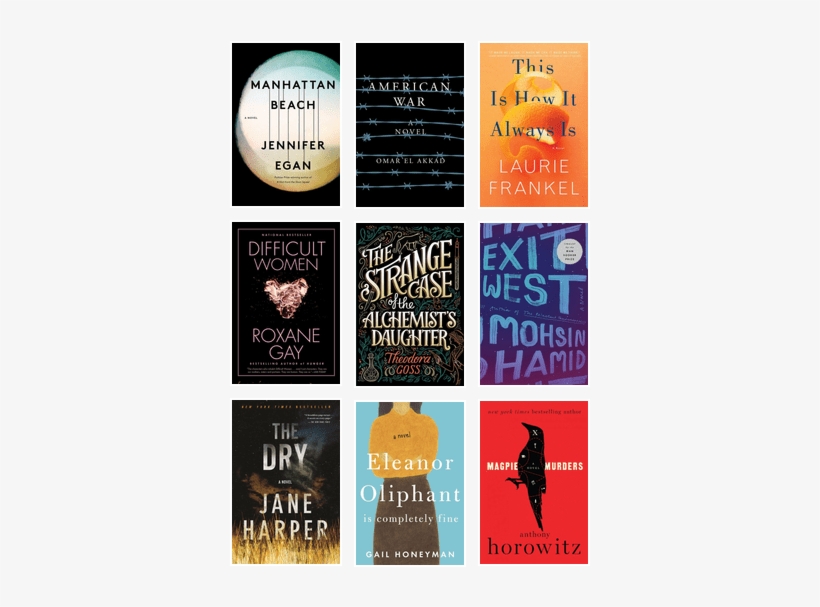
Where is `book covers`? The image size is (820, 607). book covers is located at coordinates (299, 476), (381, 487), (517, 514), (563, 358), (427, 344), (281, 378), (276, 103), (420, 123), (530, 112).